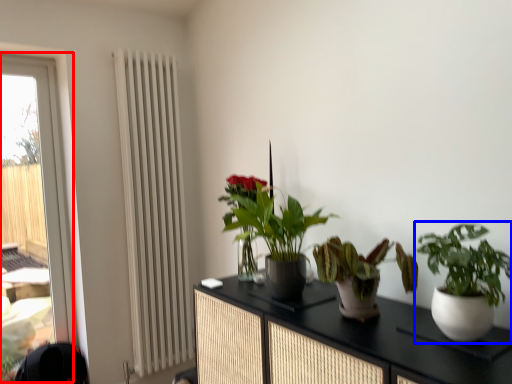
Question: Among these objects, which one is nearest to the camera, window (highlighted by a red box) or houseplant (highlighted by a blue box)?

Choices:
 (A) window
 (B) houseplant

Answer: (B)